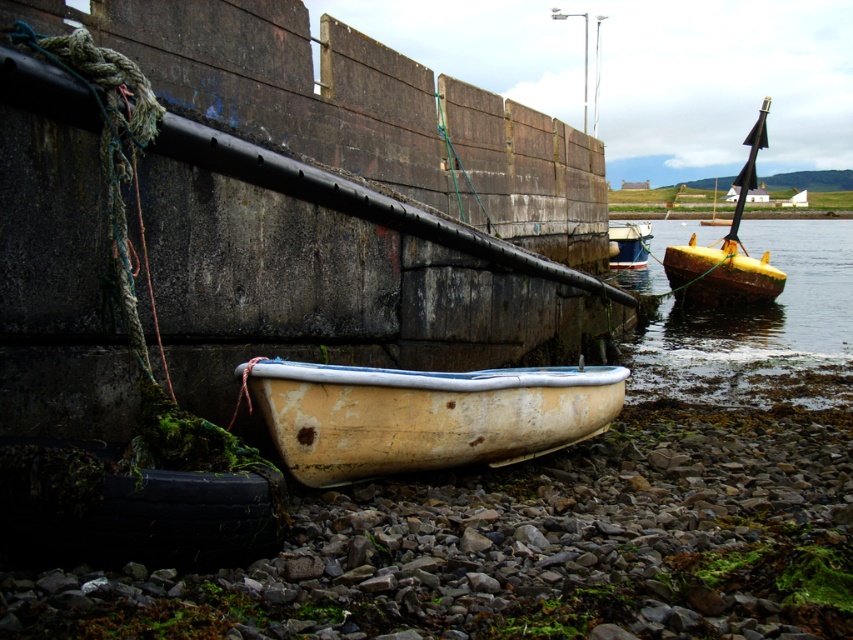
Find the location of a particular element. The height and width of the screenshot is (640, 853). rusty wood boat at lower center is located at coordinates (424, 413).

Is rusty wood boat at lower center to the right of rusty metallic boat at right from the viewer's perspective?

In fact, rusty wood boat at lower center is to the left of rusty metallic boat at right.

Is point (457, 440) more distant than point (718, 381)?

No, it is not.

The width and height of the screenshot is (853, 640). I want to click on rusty wood boat at lower center, so click(x=424, y=413).

Can you confirm if rusty metallic boat at right is positioned below white plastic boat at center?

Yes, rusty metallic boat at right is below white plastic boat at center.

Can you confirm if rusty metallic boat at right is positioned to the left of white plastic boat at center?

In fact, rusty metallic boat at right is to the right of white plastic boat at center.

Is point (648, 365) in front of point (622, 244)?

That is True.

Locate an element on the screen. Image resolution: width=853 pixels, height=640 pixels. rusty metallic boat at right is located at coordinates (755, 321).

Does rusty metallic boat at right have a greater width compared to yellow wooden boat at right?

Correct, the width of rusty metallic boat at right exceeds that of yellow wooden boat at right.

Who is taller, rusty metallic boat at right or yellow wooden boat at right?

rusty metallic boat at right

I want to click on rusty metallic boat at right, so click(755, 321).